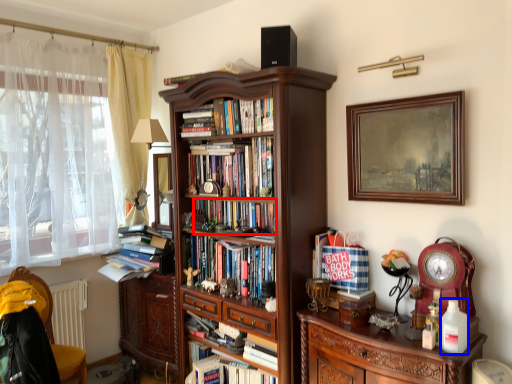
Question: Which object appears closest to the camera in this image, book (highlighted by a red box) or bottle (highlighted by a blue box)?

Choices:
 (A) book
 (B) bottle

Answer: (B)